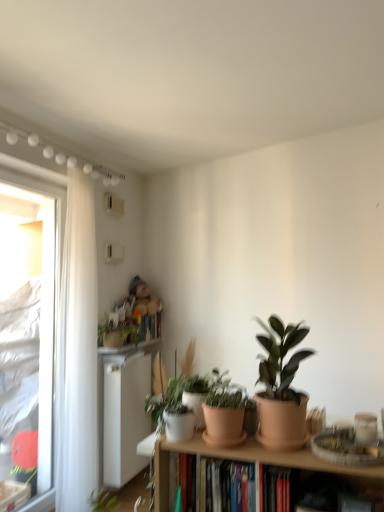
Question: Is white plastic radiator at lower left looking in the opposite direction of green matte plant at center, acting as the 2th houseplant starting from the front?

Choices:
 (A) no
 (B) yes

Answer: (A)

Question: Is white plastic radiator at lower left at the right side of green matte plant at center, the second houseplant viewed from the right?

Choices:
 (A) yes
 (B) no

Answer: (B)

Question: Does white plastic radiator at lower left have a lesser height compared to green matte plant at center, the 2th houseplant positioned from the left?

Choices:
 (A) yes
 (B) no

Answer: (B)

Question: Can you confirm if white plastic radiator at lower left is positioned to the left of green matte plant at center, the second houseplant viewed from the right?

Choices:
 (A) yes
 (B) no

Answer: (A)

Question: Is white plastic radiator at lower left thinner than green matte plant at center, the 2th houseplant positioned from the left?

Choices:
 (A) no
 (B) yes

Answer: (B)

Question: Considering the positions of terracotta clay pot at center and hardcover books at center in the image, is terracotta clay pot at center wider or thinner than hardcover books at center?

Choices:
 (A) wide
 (B) thin

Answer: (B)

Question: Is terracotta clay pot at center spatially inside hardcover books at center, or outside of it?

Choices:
 (A) outside
 (B) inside

Answer: (A)

Question: From a real-world perspective, is terracotta clay pot at center physically located above or below hardcover books at center?

Choices:
 (A) above
 (B) below

Answer: (A)

Question: From the image's perspective, is terracotta clay pot at center positioned above or below hardcover books at center?

Choices:
 (A) below
 (B) above

Answer: (B)

Question: Visually, is terracotta clay pot at center positioned to the left or to the right of white plastic radiator at lower left?

Choices:
 (A) right
 (B) left

Answer: (A)

Question: From the image's perspective, is terracotta clay pot at center located above or below white plastic radiator at lower left?

Choices:
 (A) above
 (B) below

Answer: (A)

Question: Would you say terracotta clay pot at center is inside or outside white plastic radiator at lower left?

Choices:
 (A) outside
 (B) inside

Answer: (A)

Question: Considering their positions, is terracotta clay pot at center located in front of or behind white plastic radiator at lower left?

Choices:
 (A) front
 (B) behind

Answer: (A)

Question: Would you say transparent plastic window at left is to the left or to the right of white plastic radiator at lower left in the picture?

Choices:
 (A) right
 (B) left

Answer: (B)

Question: In terms of size, does transparent plastic window at left appear bigger or smaller than white plastic radiator at lower left?

Choices:
 (A) small
 (B) big

Answer: (B)